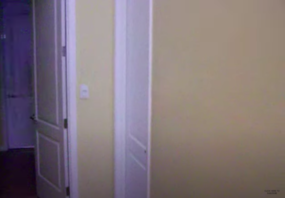
At what (x,y) coordinates should I click in order to perform the action: click on pale yellow paint. Please return your answer as a coordinate pair (x, y). The width and height of the screenshot is (285, 198). Looking at the image, I should click on (86, 37), (239, 70).